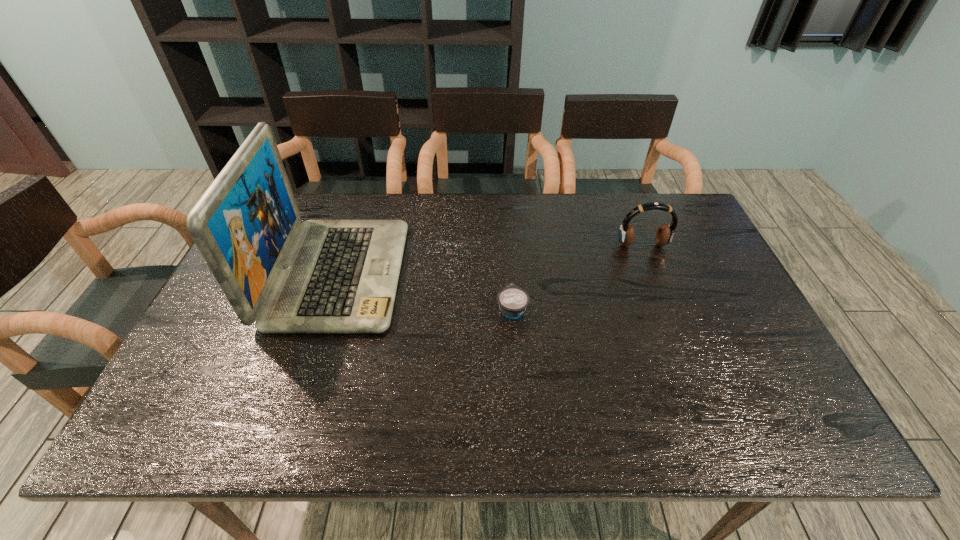
Locate an element on the screen. the second closest object to the tallest object is located at coordinates (664, 235).

The image size is (960, 540). I want to click on free location that satisfies the following two spatial constraints: 1. on the ear cup of the headset; 2. on the screen of the laptop computer, so click(x=654, y=274).

Where is `blank space that satisfies the following two spatial constraints: 1. on the ear cup of the headset; 2. on the screen of the leftmost object`? The image size is (960, 540). blank space that satisfies the following two spatial constraints: 1. on the ear cup of the headset; 2. on the screen of the leftmost object is located at coordinates (654, 274).

Find the location of a particular element. This screenshot has width=960, height=540. free spot that satisfies the following two spatial constraints: 1. on the ear cup of the rightmost object; 2. on the screen of the laptop computer is located at coordinates (654, 274).

Find the location of `vacant space that satisfies the following two spatial constraints: 1. on the screen of the leftmost object; 2. on the back side of the shortest object`. vacant space that satisfies the following two spatial constraints: 1. on the screen of the leftmost object; 2. on the back side of the shortest object is located at coordinates (326, 309).

I want to click on free space that satisfies the following two spatial constraints: 1. on the ear cup of the second shortest object; 2. on the screen of the tallest object, so click(654, 274).

At what (x,y) coordinates should I click in order to perform the action: click on vacant area in the image that satisfies the following two spatial constraints: 1. on the screen of the tallest object; 2. on the back side of the yogurt. Please return your answer as a coordinate pair (x, y). The height and width of the screenshot is (540, 960). Looking at the image, I should click on (326, 309).

Locate an element on the screen. vacant position in the image that satisfies the following two spatial constraints: 1. on the ear cup of the rightmost object; 2. on the screen of the tallest object is located at coordinates (654, 274).

The height and width of the screenshot is (540, 960). I want to click on free space that satisfies the following two spatial constraints: 1. on the ear cup of the headset; 2. on the screen of the tallest object, so click(654, 274).

This screenshot has height=540, width=960. I want to click on vacant point that satisfies the following two spatial constraints: 1. on the ear cup of the second shortest object; 2. on the screen of the tallest object, so click(654, 274).